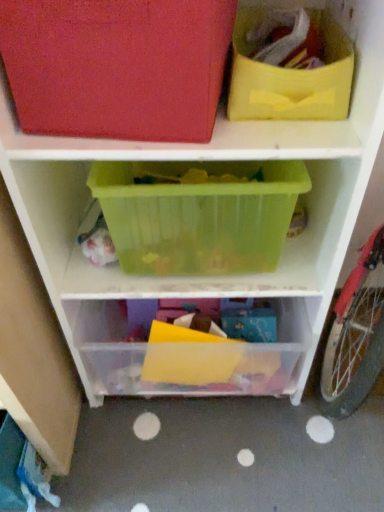
Question: Is transparent plastic container at center, arranged as the third shelf when viewed from the top, next to translucent plastic container at center, which appears as the 2th shelf when viewed from the top?

Choices:
 (A) no
 (B) yes

Answer: (A)

Question: Considering the relative sizes of transparent plastic container at center, arranged as the third shelf when viewed from the top, and translucent plastic container at center, which appears as the 2th shelf when viewed from the top, in the image provided, is transparent plastic container at center, arranged as the third shelf when viewed from the top, bigger than translucent plastic container at center, which appears as the 2th shelf when viewed from the top,?

Choices:
 (A) no
 (B) yes

Answer: (A)

Question: Can you confirm if transparent plastic container at center, placed as the first shelf when sorted from bottom to top, is taller than translucent plastic container at center, the second shelf in the bottom-to-top sequence?

Choices:
 (A) yes
 (B) no

Answer: (A)

Question: Is transparent plastic container at center, arranged as the third shelf when viewed from the top, located outside translucent plastic container at center, the second shelf in the bottom-to-top sequence?

Choices:
 (A) yes
 (B) no

Answer: (A)

Question: Can you confirm if transparent plastic container at center, placed as the first shelf when sorted from bottom to top, is shorter than translucent plastic container at center, which appears as the 2th shelf when viewed from the top?

Choices:
 (A) no
 (B) yes

Answer: (A)

Question: Considering the relative positions of translucent plastic container at center, which appears as the 2th shelf when viewed from the top, and yellow fabric bag at upper right in the image provided, is translucent plastic container at center, which appears as the 2th shelf when viewed from the top, to the left or to the right of yellow fabric bag at upper right?

Choices:
 (A) left
 (B) right

Answer: (A)

Question: Looking at the image, does translucent plastic container at center, the second shelf in the bottom-to-top sequence, seem bigger or smaller compared to yellow fabric bag at upper right?

Choices:
 (A) big
 (B) small

Answer: (A)

Question: Considering the positions of point (61, 164) and point (228, 105), is point (61, 164) closer or farther from the camera than point (228, 105)?

Choices:
 (A) farther
 (B) closer

Answer: (A)

Question: From a real-world perspective, relative to yellow fabric bag at upper right, is translucent plastic container at center, the second shelf in the bottom-to-top sequence, vertically above or below?

Choices:
 (A) above
 (B) below

Answer: (B)

Question: From the image's perspective, relative to translucent plastic container at center, the second shelf in the bottom-to-top sequence, is transparent plastic container at center, placed as the first shelf when sorted from bottom to top, above or below?

Choices:
 (A) above
 (B) below

Answer: (B)

Question: Looking at the image, does transparent plastic container at center, placed as the first shelf when sorted from bottom to top, seem bigger or smaller compared to translucent plastic container at center, the second shelf in the bottom-to-top sequence?

Choices:
 (A) big
 (B) small

Answer: (B)

Question: From a real-world perspective, relative to translucent plastic container at center, which appears as the 2th shelf when viewed from the top, is transparent plastic container at center, placed as the first shelf when sorted from bottom to top, vertically above or below?

Choices:
 (A) above
 (B) below

Answer: (B)

Question: In terms of height, does transparent plastic container at center, arranged as the third shelf when viewed from the top, look taller or shorter compared to translucent plastic container at center, which appears as the 2th shelf when viewed from the top?

Choices:
 (A) short
 (B) tall

Answer: (B)

Question: From their relative heights in the image, would you say yellow fabric bag at upper right is taller or shorter than matte red storage bin at upper left, positioned as the third shelf in bottom-to-top order?

Choices:
 (A) tall
 (B) short

Answer: (B)

Question: From the image's perspective, is yellow fabric bag at upper right positioned above or below matte red storage bin at upper left, positioned as the third shelf in bottom-to-top order?

Choices:
 (A) below
 (B) above

Answer: (A)